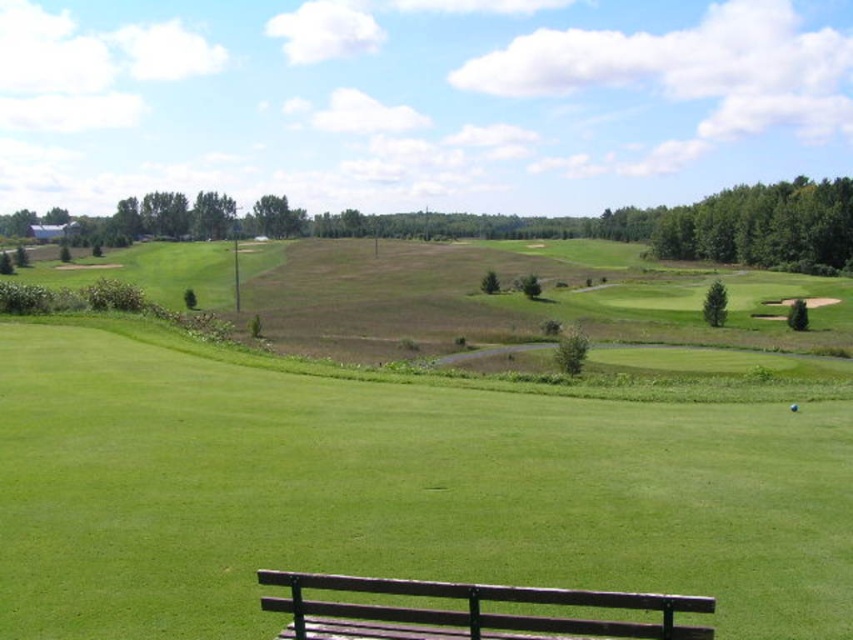
Is green grassy field at center above brown wooden bench at lower center?

Incorrect, green grassy field at center is not positioned above brown wooden bench at lower center.

Is point (479, 403) more distant than point (299, 600)?

Yes, point (479, 403) is behind point (299, 600).

The height and width of the screenshot is (640, 853). What are the coordinates of `green grassy field at center` in the screenshot? It's located at (396, 486).